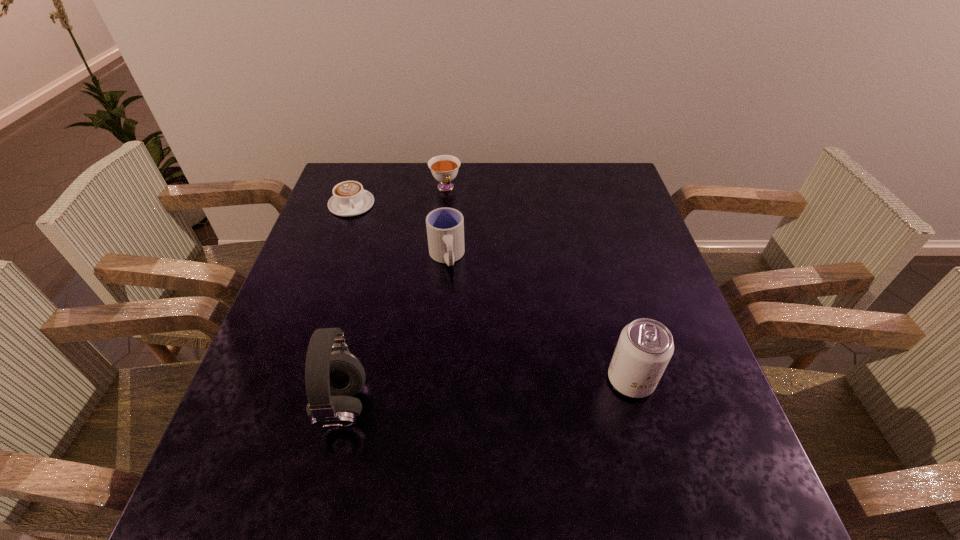
Find the location of a particular element. teacup that is positioned at the far edge is located at coordinates (444, 168).

Where is `cappuccino situated at the far edge`? This screenshot has height=540, width=960. cappuccino situated at the far edge is located at coordinates (349, 198).

What are the coordinates of `object located in the near edge section of the desktop` in the screenshot? It's located at (333, 375).

Locate an element on the screen. The height and width of the screenshot is (540, 960). headset located in the left edge section of the desktop is located at coordinates [333, 375].

I want to click on cappuccino situated at the left edge, so (349, 198).

The image size is (960, 540). What are the coordinates of `object located at the right edge` in the screenshot? It's located at (645, 346).

Locate an element on the screen. The height and width of the screenshot is (540, 960). object located in the far left corner section of the desktop is located at coordinates (349, 198).

Where is `object present at the near left corner`? The image size is (960, 540). object present at the near left corner is located at coordinates (333, 375).

Locate an element on the screen. free spot at the far edge of the desktop is located at coordinates tap(559, 197).

I want to click on vacant position at the left edge of the desktop, so tap(342, 257).